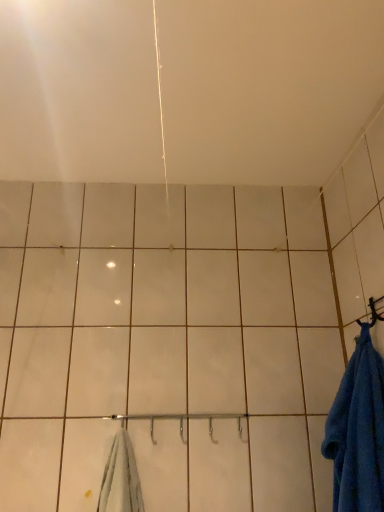
Measure the distance between blue fabric hanger at right and camera.

They are 37.48 inches apart.

I want to click on blue fabric hanger at right, so click(376, 310).

What do you see at coordinates (376, 310) in the screenshot?
I see `blue fabric hanger at right` at bounding box center [376, 310].

This screenshot has height=512, width=384. Identify the location of blue fabric hanger at right. point(376,310).